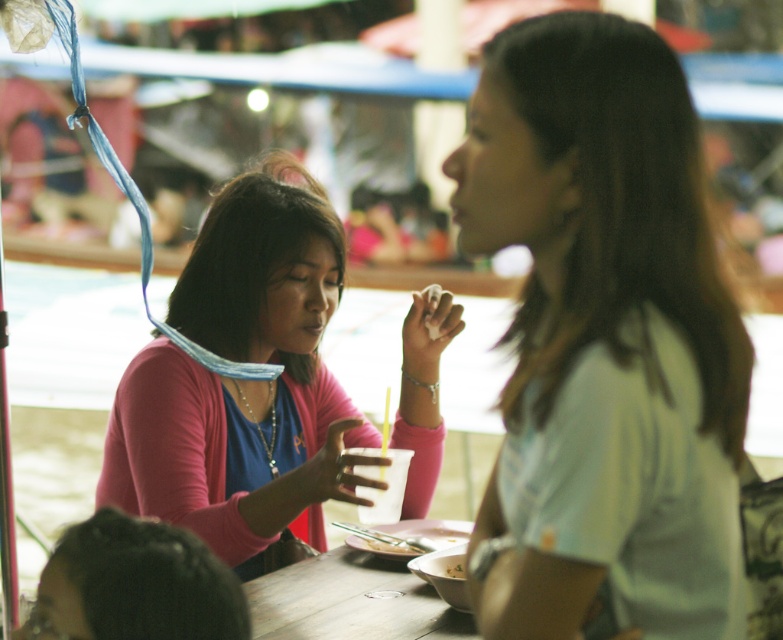
Question: Is light beige shirt at right further to camera compared to wooden table at center?

Choices:
 (A) no
 (B) yes

Answer: (A)

Question: Is light beige shirt at right thinner than wooden table at center?

Choices:
 (A) yes
 (B) no

Answer: (A)

Question: Considering the real-world distances, which object is farthest from the wooden table at center?

Choices:
 (A) white matte bowl at lower center
 (B) light beige shirt at right
 (C) pink matte sweater at center

Answer: (B)

Question: Can you confirm if pink matte sweater at center is positioned to the left of white matte bowl at lower center?

Choices:
 (A) yes
 (B) no

Answer: (A)

Question: Which point is closer to the camera?

Choices:
 (A) light beige shirt at right
 (B) pink matte sweater at center

Answer: (A)

Question: Estimate the real-world distances between objects in this image. Which object is farther from the wooden table at center?

Choices:
 (A) light beige shirt at right
 (B) pink matte sweater at center
 (C) white matte bowl at lower center

Answer: (A)